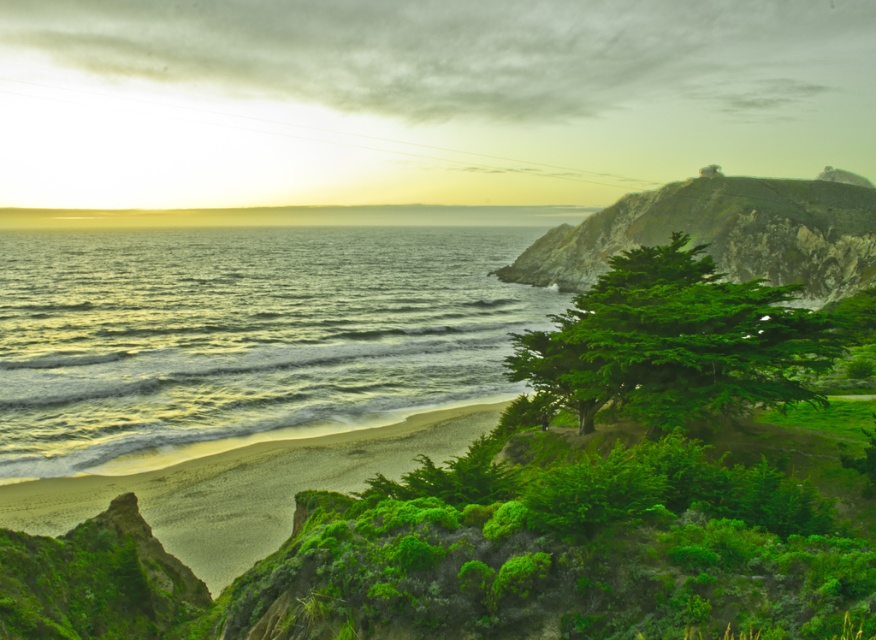
Locate an element on the screen. The image size is (876, 640). greenish-blue water at lower left is located at coordinates (244, 336).

Can you confirm if greenish-blue water at lower left is wider than green leafy tree at center?

Yes, greenish-blue water at lower left is wider than green leafy tree at center.

Does point (81, 458) lie in front of point (724, 358)?

No.

The height and width of the screenshot is (640, 876). I want to click on greenish-blue water at lower left, so click(244, 336).

Does point (701, 321) come farther from viewer compared to point (590, 262)?

No, (701, 321) is closer to viewer.

Consider the image. Does green leafy tree at center have a lesser width compared to green mossy cliff at upper right?

Yes, green leafy tree at center is thinner than green mossy cliff at upper right.

You are a GUI agent. You are given a task and a screenshot of the screen. Output one action in this format:
    pyautogui.click(x=<x>, y=<y>)
    Task: Click on the green leafy tree at center
    
    Given the screenshot: What is the action you would take?
    pyautogui.click(x=675, y=340)

Which is more to the right, greenish-blue water at lower left or green mossy cliff at upper right?

green mossy cliff at upper right is more to the right.

Is greenish-blue water at lower left smaller than green mossy cliff at upper right?

No, greenish-blue water at lower left is not smaller than green mossy cliff at upper right.

Between point (22, 448) and point (707, 198), which one is positioned behind?

Positioned behind is point (707, 198).

The width and height of the screenshot is (876, 640). What are the coordinates of `greenish-blue water at lower left` in the screenshot? It's located at (244, 336).